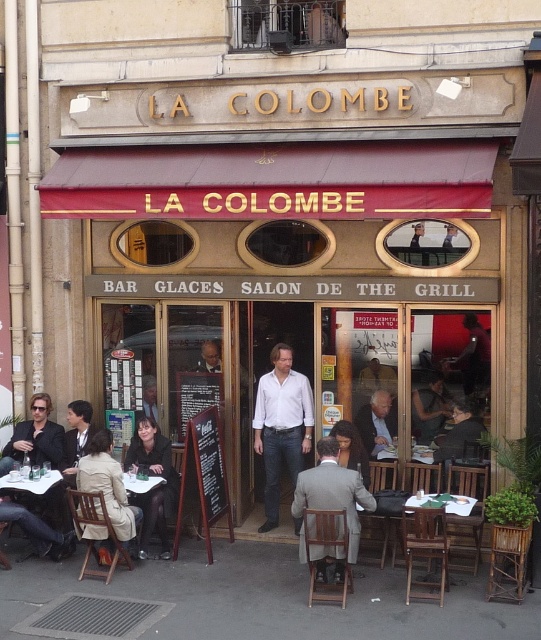
You are a customer entering the restaurant and see the light beige coat at lower left and the white glossy table at lower left. You want to place your coat on the table. Is the coat close enough to the table to easily reach it without moving?

The distance between the light beige coat at lower left and the white glossy table at lower left is 20.22 inches, which is close enough for a person to easily reach without needing to move.

You are a customer at La Colombe restaurant. You notice a white matte shirt at center and a wooden table at center. Which object takes up more space in the scene?

The white matte shirt at center is bigger than the wooden table at center, so it takes up more space in the scene.